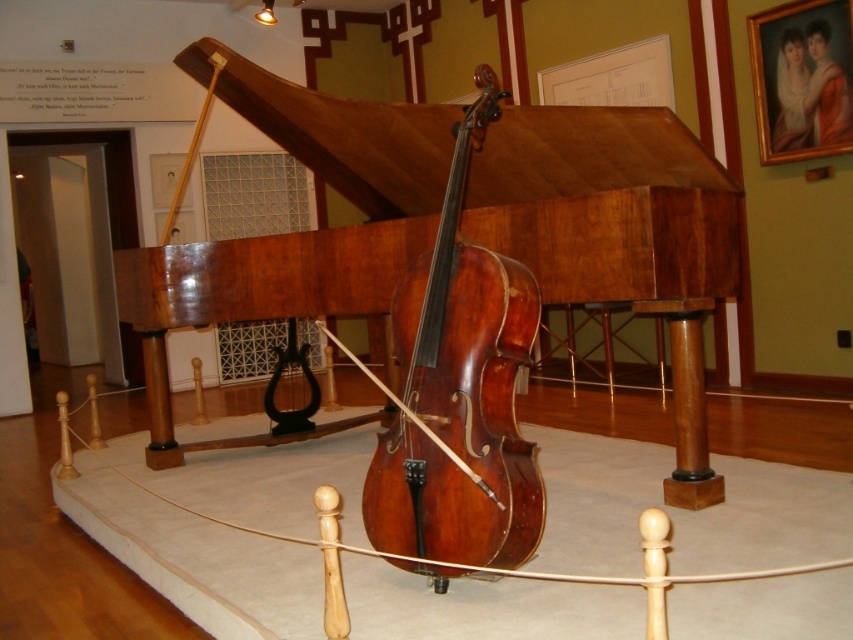
Question: Is the position of shiny brown wood cello at center more distant than that of matte oil painting at upper right?

Choices:
 (A) no
 (B) yes

Answer: (A)

Question: In this image, where is shiny polished wood piano at center located relative to matte oil painting at upper right?

Choices:
 (A) right
 (B) left

Answer: (B)

Question: Which is farther from the matte oil painting at upper right?

Choices:
 (A) shiny polished wood piano at center
 (B) shiny brown wood cello at center

Answer: (B)

Question: Which point is farther from the camera taking this photo?

Choices:
 (A) (228, 257)
 (B) (827, 26)

Answer: (B)

Question: Where is shiny brown wood cello at center located in relation to matte oil painting at upper right in the image?

Choices:
 (A) left
 (B) right

Answer: (A)

Question: Which of these objects is positioned farthest from the shiny brown wood cello at center?

Choices:
 (A) shiny polished wood piano at center
 (B) matte oil painting at upper right

Answer: (B)